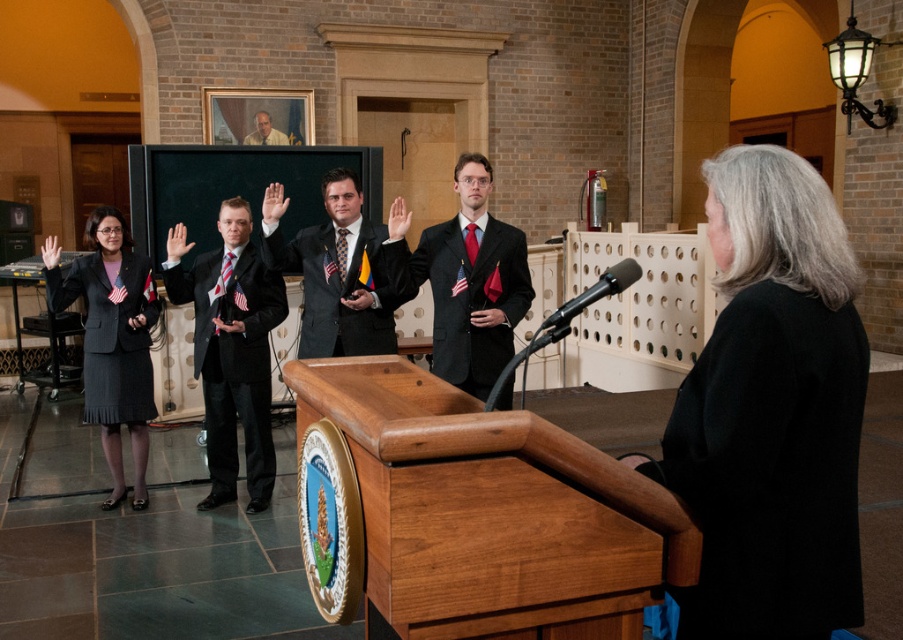
Does black wool business suit at center appear over shiny black suit at center?

Incorrect, black wool business suit at center is not positioned above shiny black suit at center.

The image size is (903, 640). I want to click on black wool business suit at center, so click(x=771, y=467).

This screenshot has width=903, height=640. What do you see at coordinates (771, 467) in the screenshot? I see `black wool business suit at center` at bounding box center [771, 467].

This screenshot has width=903, height=640. Find the location of `black wool business suit at center`. black wool business suit at center is located at coordinates (771, 467).

Does shiny black suit at center have a larger size compared to matte black suit at upper center?

Yes, shiny black suit at center is bigger than matte black suit at upper center.

Who is more forward, (370,225) or (247,134)?

Positioned in front is point (370,225).

Identify the location of shiny black suit at center. Image resolution: width=903 pixels, height=640 pixels. (334, 272).

Looking at this image, who is higher up, black wool business suit at center or matte black suit at upper center?

Positioned higher is matte black suit at upper center.

Does black wool business suit at center appear under matte black suit at upper center?

Correct, black wool business suit at center is located below matte black suit at upper center.

Image resolution: width=903 pixels, height=640 pixels. In order to click on black wool business suit at center in this screenshot , I will do `click(771, 467)`.

Identify the location of black wool business suit at center. This screenshot has width=903, height=640. (771, 467).